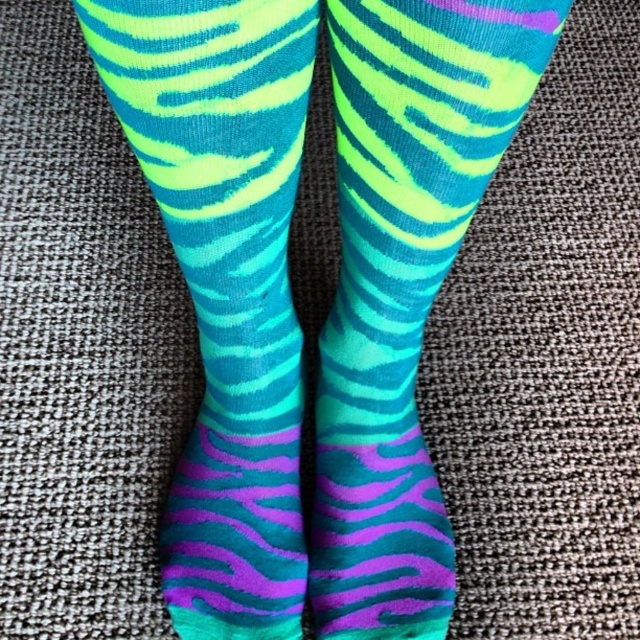
Does neon green fabric socks at left have a smaller size compared to neon green fabric socks at center?

No.

Does neon green fabric socks at left have a lesser height compared to neon green fabric socks at center?

Correct, neon green fabric socks at left is not as tall as neon green fabric socks at center.

Locate an element on the screen. The width and height of the screenshot is (640, 640). neon green fabric socks at left is located at coordinates (225, 284).